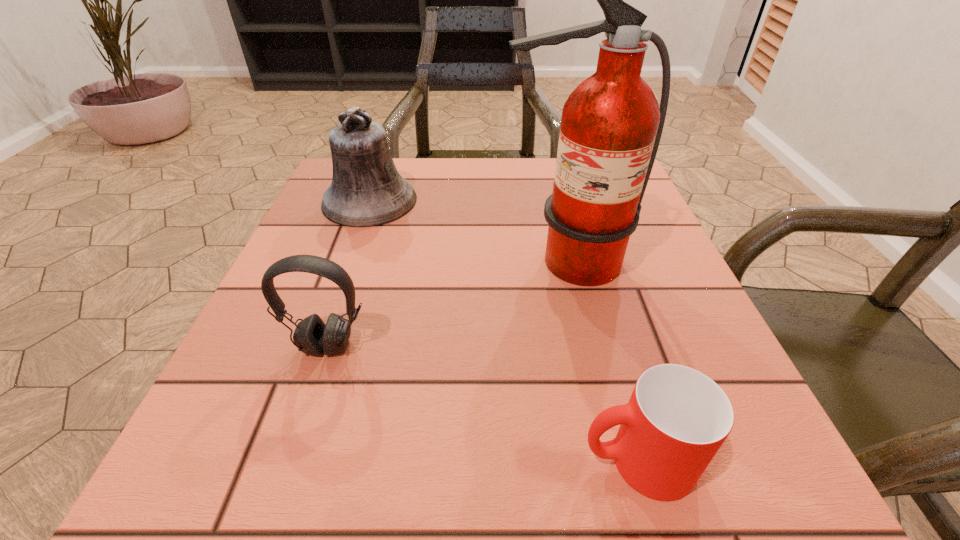
In order to click on object at the far left corner in this screenshot , I will do `click(366, 190)`.

What are the coordinates of `object that is at the near right corner` in the screenshot? It's located at (677, 418).

This screenshot has width=960, height=540. In the image, there is a desktop. In order to click on vacant space at the far edge in this screenshot , I will do (470, 176).

This screenshot has height=540, width=960. I want to click on vacant space at the near edge of the desktop, so click(x=392, y=511).

Identify the location of free region at the left edge of the desktop. (331, 225).

The height and width of the screenshot is (540, 960). What are the coordinates of `vacant region at the right edge of the desktop` in the screenshot? It's located at pos(640,234).

This screenshot has width=960, height=540. Find the location of `blank region between the second farthest object and the nearest object`. blank region between the second farthest object and the nearest object is located at coordinates (601, 361).

Locate an element on the screen. This screenshot has height=540, width=960. empty space between the fire extinguisher and the farthest object is located at coordinates (468, 231).

At what (x,y) coordinates should I click in order to perform the action: click on free area in between the nearest object and the second shortest object. Please return your answer as a coordinate pair (x, y). The height and width of the screenshot is (540, 960). Looking at the image, I should click on (483, 403).

Where is `free space between the farthest object and the third farthest object`? free space between the farthest object and the third farthest object is located at coordinates (348, 273).